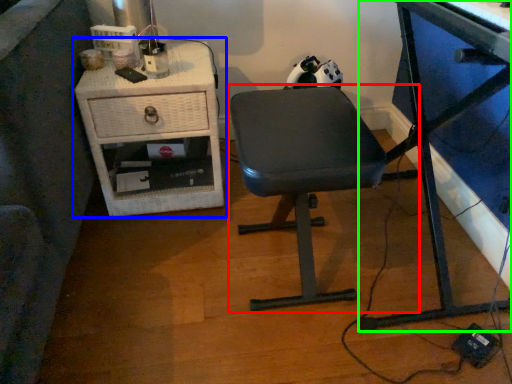
Question: Estimate the real-world distances between objects in this image. Which object is farther from chair (highlighted by a red box), nightstand (highlighted by a blue box) or desk (highlighted by a green box)?

Choices:
 (A) nightstand
 (B) desk

Answer: (A)